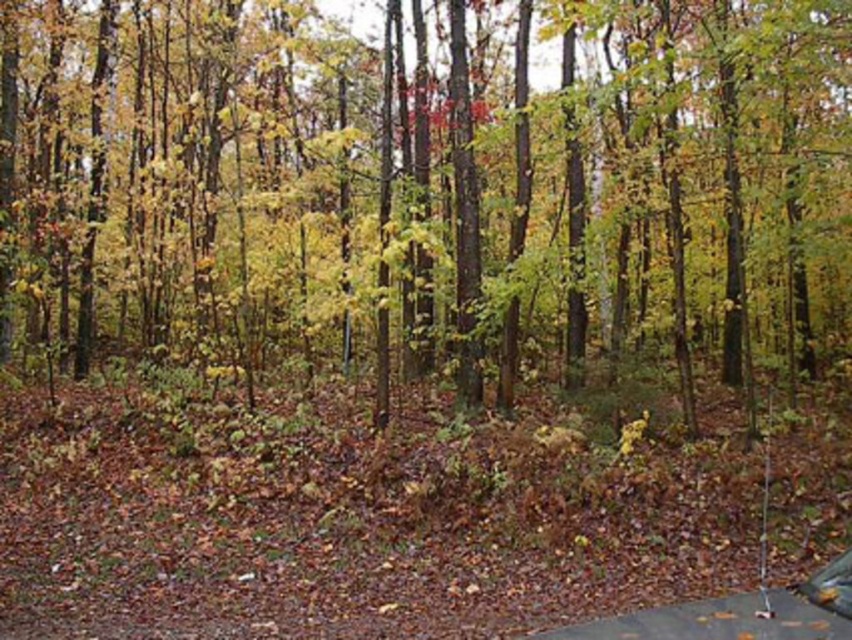
Who is more forward, [417,170] or [827,566]?

Point [827,566] is more forward.

Is yellow-green leaves at center closer to camera compared to metallic silver car at lower right?

No, yellow-green leaves at center is further to the viewer.

What do you see at coordinates (427, 188) in the screenshot?
I see `yellow-green leaves at center` at bounding box center [427, 188].

Where is `yellow-green leaves at center`? yellow-green leaves at center is located at coordinates (427, 188).